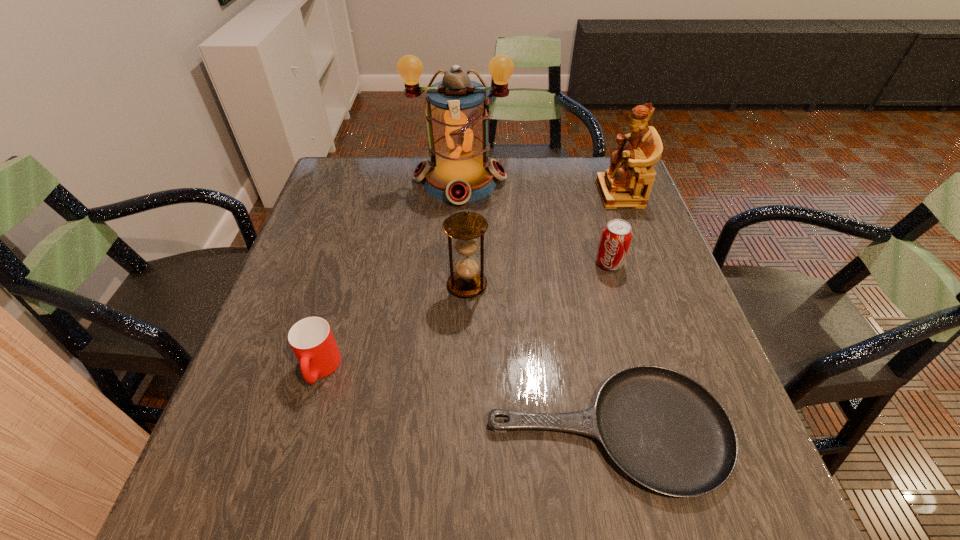
The image size is (960, 540). What are the coordinates of `soda present at the right edge` in the screenshot? It's located at (616, 236).

Where is `frying pan located at the right edge`? frying pan located at the right edge is located at coordinates (665, 430).

The image size is (960, 540). What are the coordinates of `object positioned at the far right corner` in the screenshot? It's located at (627, 183).

The image size is (960, 540). Identify the location of object located at the near right corner. (665, 430).

Identify the location of free spot at the far edge of the desktop. The width and height of the screenshot is (960, 540). (554, 159).

This screenshot has height=540, width=960. What are the coordinates of `blank space at the near edge` in the screenshot? It's located at (533, 476).

This screenshot has height=540, width=960. Identify the location of vacant position at the left edge of the desktop. [x=311, y=226].

Where is `vacant point at the right edge`? This screenshot has width=960, height=540. vacant point at the right edge is located at coordinates (623, 313).

The image size is (960, 540). I want to click on vacant point located between the fifth shortest object and the third tallest object, so click(543, 239).

Where is `blank region between the fourth shortest object and the second shortest object`? blank region between the fourth shortest object and the second shortest object is located at coordinates (394, 327).